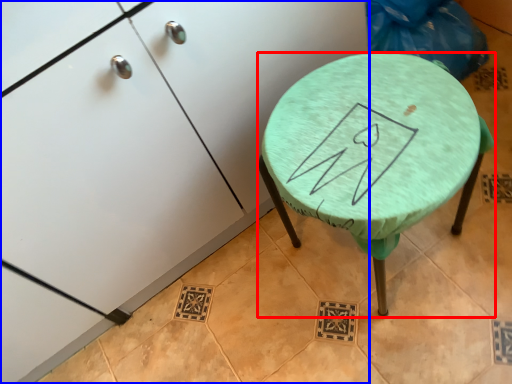
Question: Which point is further to the camera, stool (highlighted by a red box) or furniture (highlighted by a blue box)?

Choices:
 (A) stool
 (B) furniture

Answer: (A)